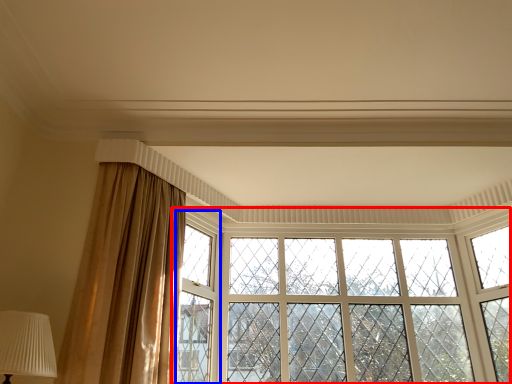
Question: Which point is closer to the camera, window (highlighted by a red box) or window frame (highlighted by a blue box)?

Choices:
 (A) window
 (B) window frame

Answer: (B)